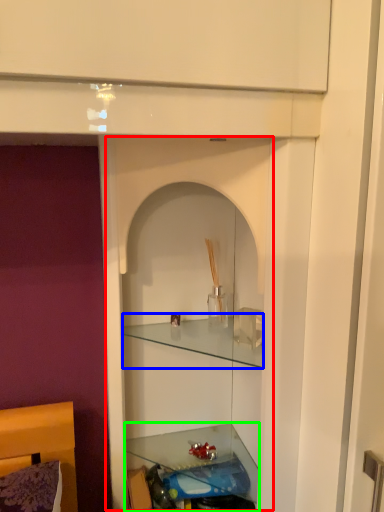
Question: Estimate the real-world distances between objects in this image. Which object is closer to cabinet (highlighted by a red box), cabinet (highlighted by a blue box) or shelf (highlighted by a green box)?

Choices:
 (A) cabinet
 (B) shelf

Answer: (A)